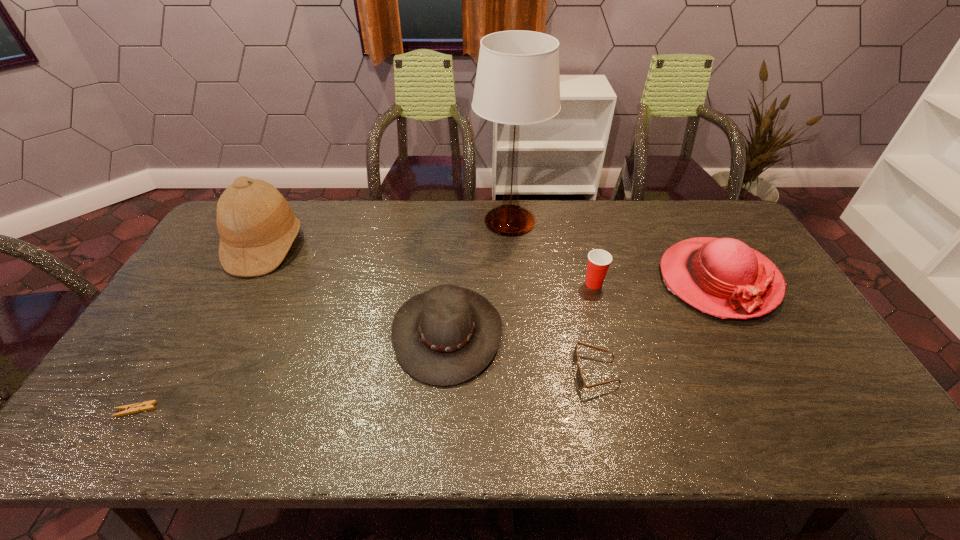
Image resolution: width=960 pixels, height=540 pixels. What are the coordinates of `vacant region located 0.290m above the cylindrical shade of the tallest object` in the screenshot? It's located at (392, 221).

You are a GUI agent. You are given a task and a screenshot of the screen. Output one action in this format:
    pyautogui.click(x=<x>, y=<y>)
    Task: Click on the free space located 0.150m above the cylindrical shade of the tallest object
    This screenshot has width=960, height=540.
    Given the screenshot: What is the action you would take?
    pyautogui.click(x=431, y=221)

You are a GUI agent. You are given a task and a screenshot of the screen. Output one action in this format:
    pyautogui.click(x=<x>, y=<y>)
    Task: Click on the vacant space situated on the front-facing side of the leftmost hat
    
    Given the screenshot: What is the action you would take?
    pyautogui.click(x=334, y=246)

Identify the location of free space located 0.050m at the front of the rightmost object with a bow. This screenshot has height=540, width=960. (750, 339).

Find the location of `vacant space situated on the front-facing side of the second hat from left to right`. vacant space situated on the front-facing side of the second hat from left to right is located at coordinates (528, 333).

You are a GUI agent. You are given a task and a screenshot of the screen. Output one action in this format:
    pyautogui.click(x=<x>, y=<y>)
    Task: Click on the free space located 0.090m on the right of the Dixie cup
    
    Given the screenshot: What is the action you would take?
    pyautogui.click(x=635, y=284)

Where is `vacant space located on the frames of the second shortest object`? The image size is (960, 540). vacant space located on the frames of the second shortest object is located at coordinates (479, 372).

Where is `free space located 0.170m on the frames of the second shortest object`? free space located 0.170m on the frames of the second shortest object is located at coordinates (507, 372).

Identify the location of free space located on the frames of the second shortest object. This screenshot has height=540, width=960. (447, 372).

Find the location of a particular element. Image resolution: width=960 pixels, height=540 pixels. vacant space situated 0.360m on the right of the nearest object is located at coordinates (308, 410).